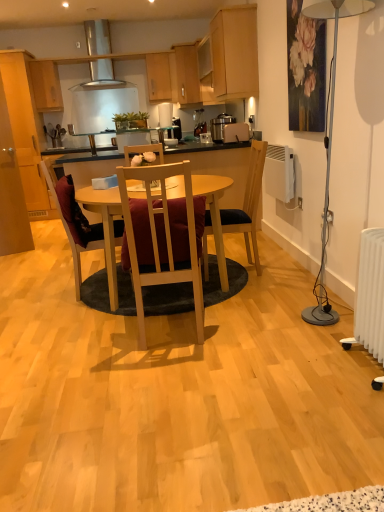
Question: Does satin silver exhaust hood at upper center come behind velvet maroon chair at center, the 1th chair positioned from the left?

Choices:
 (A) no
 (B) yes

Answer: (B)

Question: Is satin silver exhaust hood at upper center thinner than velvet maroon chair at center, the 1th chair positioned from the left?

Choices:
 (A) yes
 (B) no

Answer: (A)

Question: Is satin silver exhaust hood at upper center oriented away from velvet maroon chair at center, the 1th chair positioned from the left?

Choices:
 (A) yes
 (B) no

Answer: (B)

Question: From a real-world perspective, is satin silver exhaust hood at upper center on velvet maroon chair at center, the 1th chair positioned from the left?

Choices:
 (A) yes
 (B) no

Answer: (A)

Question: Can we say satin silver exhaust hood at upper center lies outside velvet maroon chair at center, the 1th chair positioned from the left?

Choices:
 (A) yes
 (B) no

Answer: (A)

Question: Is matte wood cabinets at upper left, the 5th cabinetry in the right-to-left sequence, taller or shorter than white plastic radiator at lower right?

Choices:
 (A) tall
 (B) short

Answer: (A)

Question: From a real-world perspective, is matte wood cabinets at upper left, acting as the 1th cabinetry starting from the left, positioned above or below white plastic radiator at lower right?

Choices:
 (A) above
 (B) below

Answer: (A)

Question: Do you think matte wood cabinets at upper left, the 5th cabinetry in the right-to-left sequence, is within white plastic radiator at lower right, or outside of it?

Choices:
 (A) outside
 (B) inside

Answer: (A)

Question: From the image's perspective, is matte wood cabinets at upper left, acting as the 1th cabinetry starting from the left, above or below white plastic radiator at lower right?

Choices:
 (A) above
 (B) below

Answer: (A)

Question: From a real-world perspective, relative to wooden chair at center, the 2th chair in the left-to-right sequence, is wooden cabinet at upper center, which is the 3th cabinetry from right to left, vertically above or below?

Choices:
 (A) below
 (B) above

Answer: (B)

Question: Is point 172,55 positioned closer to the camera than point 145,181?

Choices:
 (A) closer
 (B) farther

Answer: (B)

Question: Considering the positions of wooden cabinet at upper center, which is the 3th cabinetry from right to left, and wooden chair at center, which appears as the 2th chair when viewed from the right, in the image, is wooden cabinet at upper center, which is the 3th cabinetry from right to left, bigger or smaller than wooden chair at center, which appears as the 2th chair when viewed from the right,?

Choices:
 (A) small
 (B) big

Answer: (A)

Question: Is wooden cabinet at upper center, which ranks as the 3th cabinetry in left-to-right order, to the left or to the right of wooden chair at center, the 2th chair in the left-to-right sequence, in the image?

Choices:
 (A) right
 (B) left

Answer: (B)

Question: Looking at their shapes, would you say white plastic radiator at lower right is wider or thinner than metallic silver toaster at upper center?

Choices:
 (A) wide
 (B) thin

Answer: (B)

Question: Looking at the image, does white plastic radiator at lower right seem bigger or smaller compared to metallic silver toaster at upper center?

Choices:
 (A) big
 (B) small

Answer: (A)